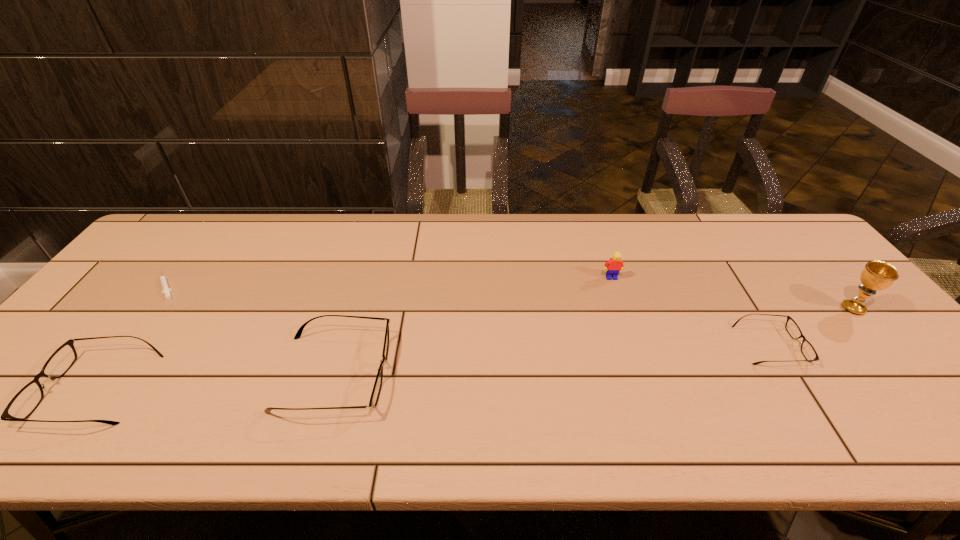
Locate an element on the screen. This screenshot has height=540, width=960. free spot between the rightmost object and the second spectacles from left to right is located at coordinates (593, 341).

The height and width of the screenshot is (540, 960). I want to click on vacant region between the chalice and the fifth tallest object, so click(811, 327).

Locate an element on the screen. The image size is (960, 540). vacant point located between the shortest object and the fourth object from right to left is located at coordinates (251, 329).

At what (x,y) coordinates should I click in order to perform the action: click on free space between the rightmost object and the second tallest spectacles. Please return your answer as a coordinate pair (x, y). The image size is (960, 540). Looking at the image, I should click on (474, 348).

Find the location of a particular element. This screenshot has width=960, height=540. vacant point located between the Lego and the fourth tallest object is located at coordinates (353, 333).

This screenshot has height=540, width=960. Find the location of `vacant point located between the second tallest object and the rightmost object`. vacant point located between the second tallest object and the rightmost object is located at coordinates (732, 293).

In order to click on object that stands as the third closest to the third shortest object in this screenshot , I will do `click(615, 264)`.

Select which object appears as the fifth closest to the rightmost object. Please provide its 2D coordinates. Your answer should be formatted as a tuple, i.e. [(x, y)], where the tuple contains the x and y coordinates of a point satisfying the conditions above.

[(166, 290)]

Where is `spectacles that is the closest to the rightmost spectacles`? The width and height of the screenshot is (960, 540). spectacles that is the closest to the rightmost spectacles is located at coordinates (374, 398).

Where is `spectacles identified as the second closest to the rightmost object`? This screenshot has height=540, width=960. spectacles identified as the second closest to the rightmost object is located at coordinates (374, 398).